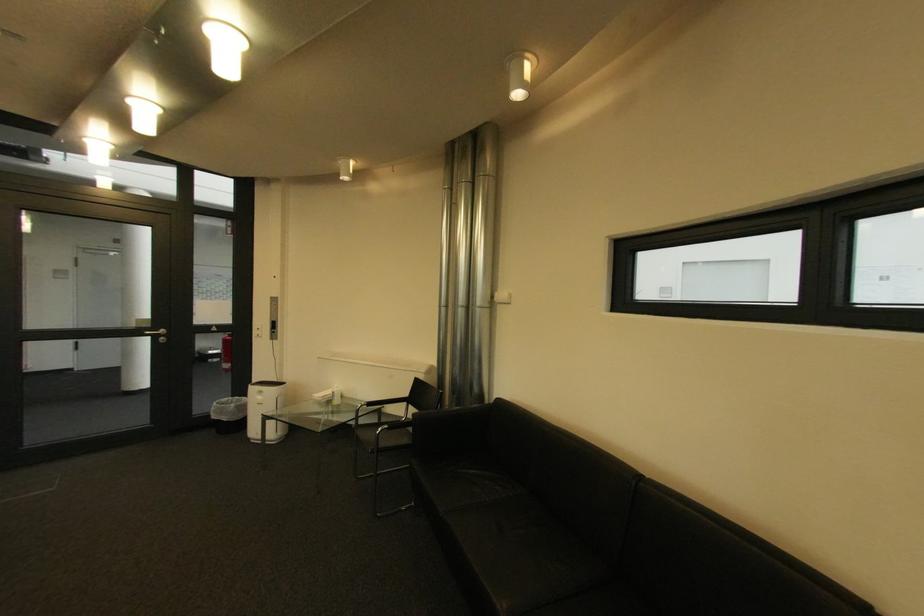
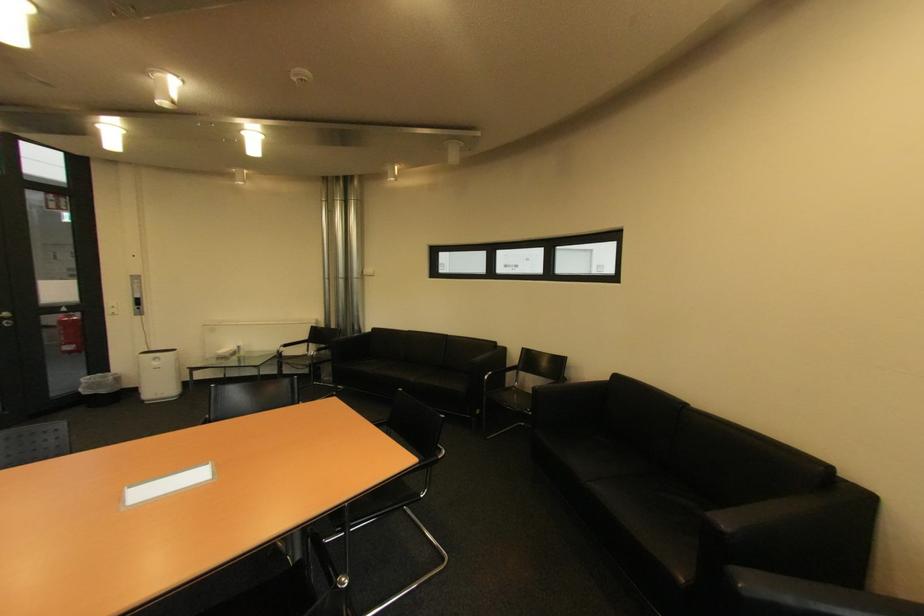
Question: I am providing you with two images of the same scene from different viewpoints. After the viewpoint changes to image2, which objects are now occluded?

Choices:
 (A) chair armrest
 (B) sofa armrest
 (C) trash can
 (D) none of these

Answer: (D)